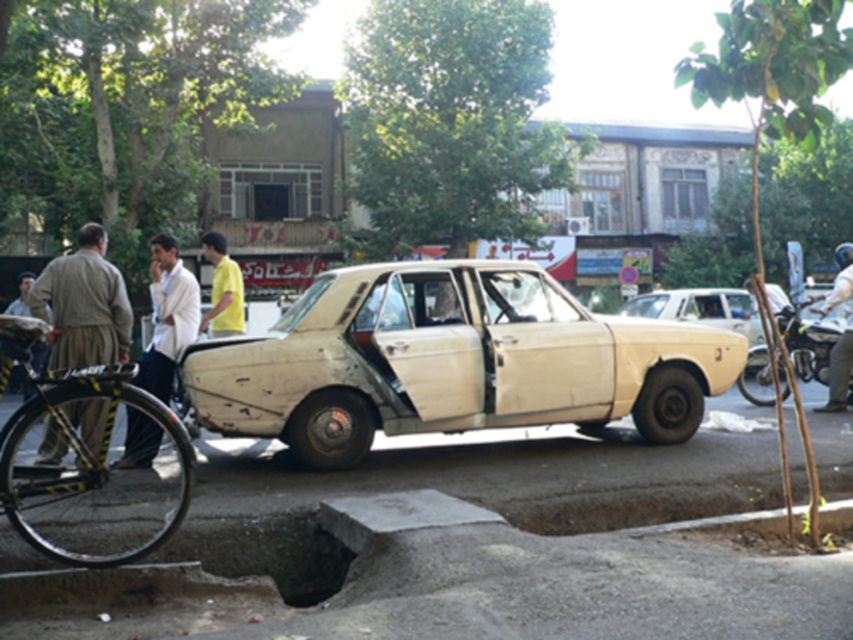
Question: Considering the relative positions of white matte car at center and metallic silver motorcycle at right in the image provided, where is white matte car at center located with respect to metallic silver motorcycle at right?

Choices:
 (A) right
 (B) left

Answer: (B)

Question: Which point is closer to the camera?

Choices:
 (A) (840, 394)
 (B) (175, 477)
 (C) (180, 285)

Answer: (B)

Question: Which point appears farthest from the camera in this image?

Choices:
 (A) (51, 545)
 (B) (149, 449)

Answer: (B)

Question: Is khaki fabric pants at left below light beige shirt at center?

Choices:
 (A) yes
 (B) no

Answer: (A)

Question: Can you confirm if white clothed man at center is positioned to the right of light beige shirt at center?

Choices:
 (A) yes
 (B) no

Answer: (B)

Question: Estimate the real-world distances between objects in this image. Which object is farther from the white matte sedan at center?

Choices:
 (A) yellow matte shirt at center
 (B) white matte car at center
 (C) light beige shirt at center

Answer: (A)